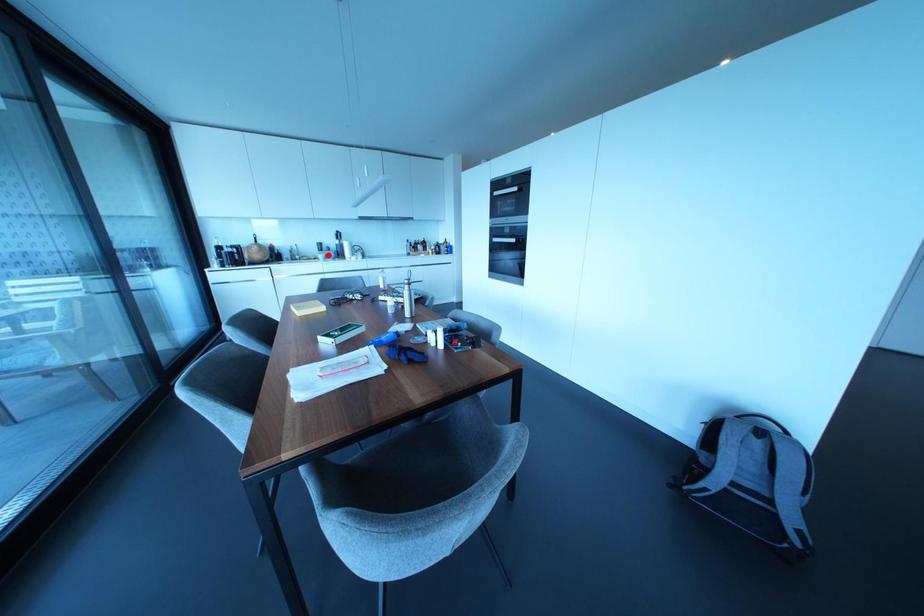
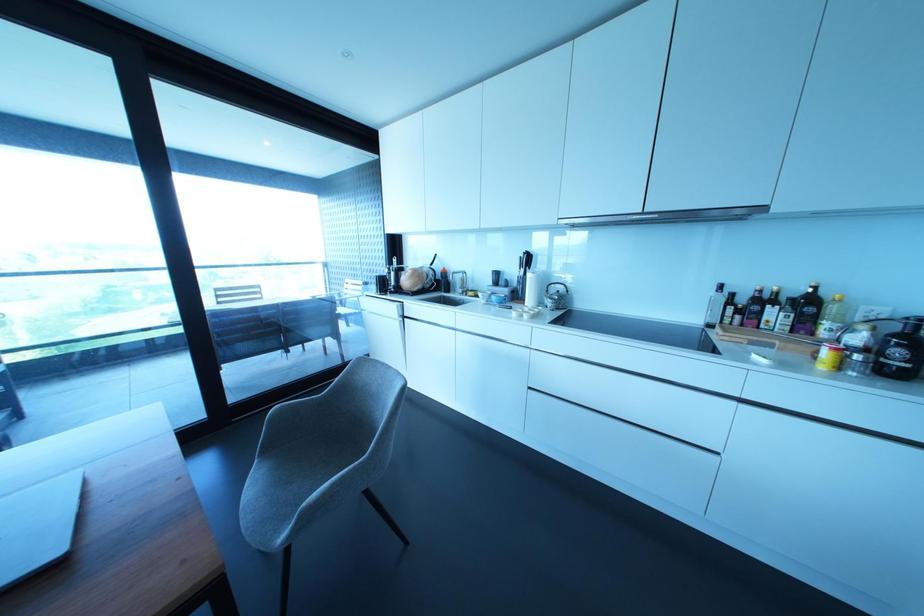
The point at the highlighted location is marked in the first image. Where is the corresponding point in the second image?

(492, 297)